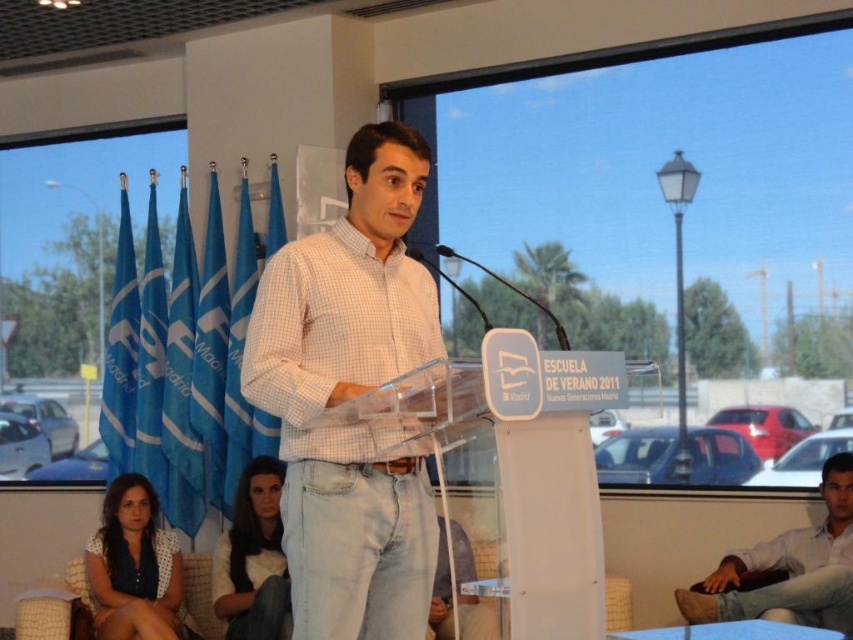
Is white checkered shirt at center to the left of light brown leather pants at lower right from the viewer's perspective?

Correct, you'll find white checkered shirt at center to the left of light brown leather pants at lower right.

The image size is (853, 640). What do you see at coordinates (350, 397) in the screenshot? I see `white checkered shirt at center` at bounding box center [350, 397].

At what (x,y) coordinates should I click in order to perform the action: click on white checkered shirt at center. Please return your answer as a coordinate pair (x, y). The height and width of the screenshot is (640, 853). Looking at the image, I should click on (350, 397).